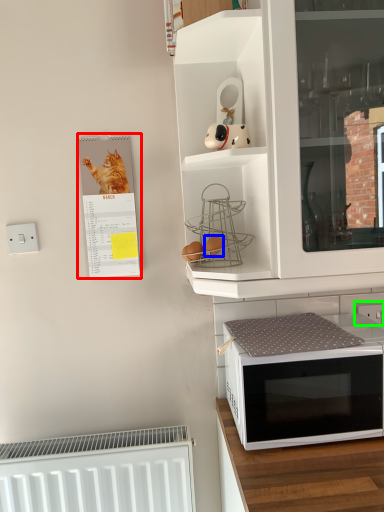
Question: Considering the real-world distances, which object is farthest from bulletin board (highlighted by a red box)? food (highlighted by a blue box) or electric outlet (highlighted by a green box)?

Choices:
 (A) food
 (B) electric outlet

Answer: (B)